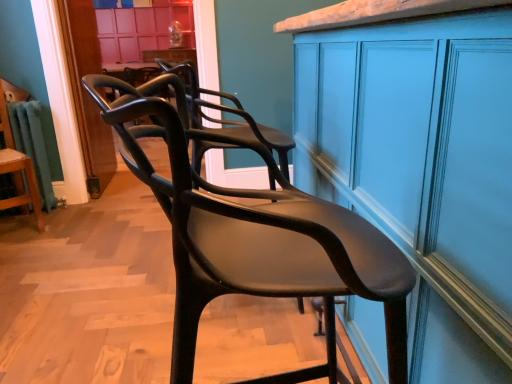
Identify the location of vacant space in matte black chair at left, arranged as the 2th chair when viewed from the front (from a real-world perspective). This screenshot has height=384, width=512. (18, 221).